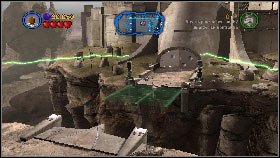
You are a GUI agent. You are given a task and a screenshot of the screen. Output one action in this format:
    pyautogui.click(x=<x>, y=<y>)
    Task: Click on the wall
    This screenshot has width=280, height=158.
    Given the screenshot: What is the action you would take?
    pyautogui.click(x=101, y=21), pyautogui.click(x=268, y=35)